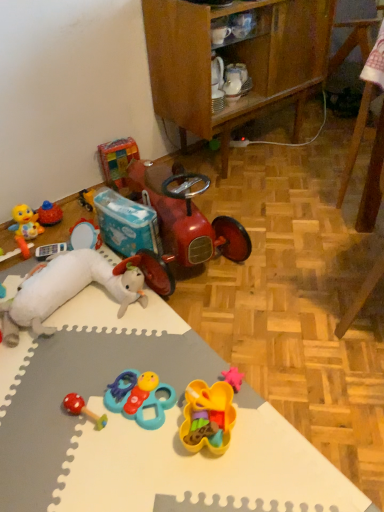
I want to click on free area in between translucent plastic toy at center, the fifth toy from the back, and white plush toy at lower left, positioned as the 2th toy in back-to-front order, so click(124, 355).